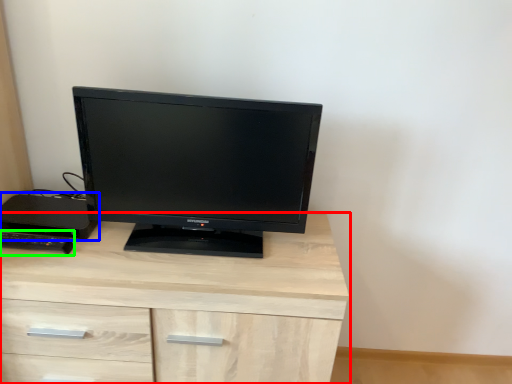
Question: Which is nearer to the chest of drawers (highlighted by a red box)? desktop (highlighted by a blue box) or desktop (highlighted by a green box).

Choices:
 (A) desktop
 (B) desktop

Answer: (A)